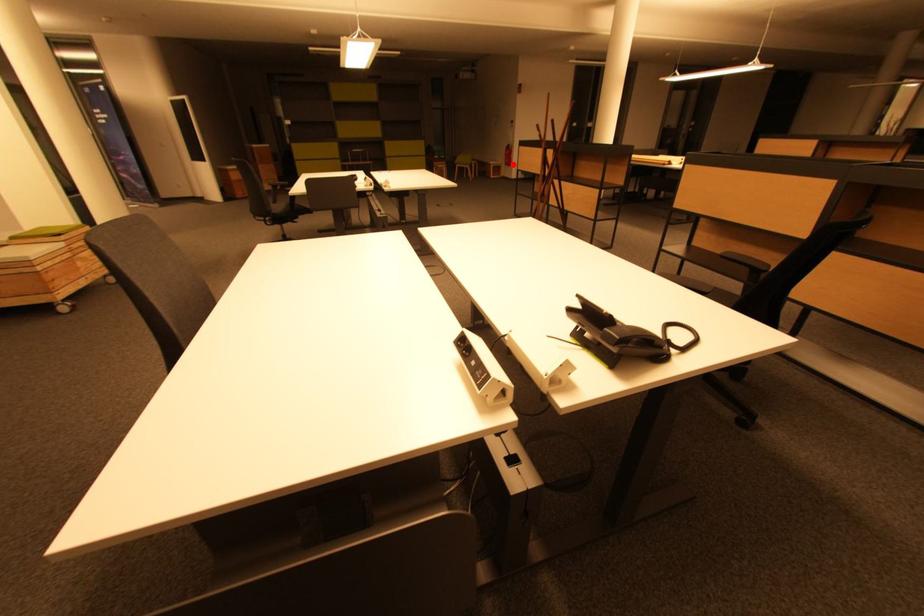
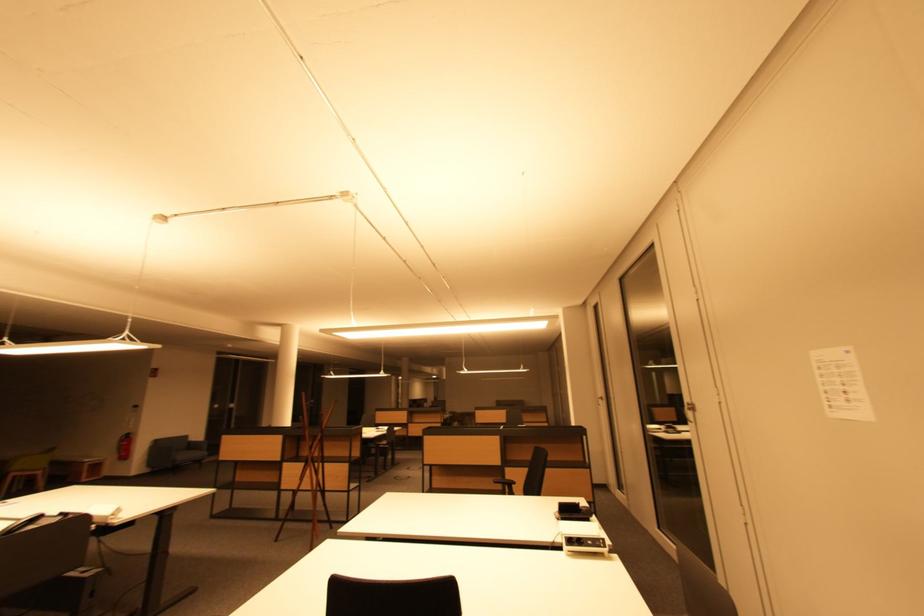
Question: I am providing you with two images of the same scene from different viewpoints. Image1 has a red point marked. In image2, the corresponding 3D location appears at what relative position? Reply with the corresponding letter.

Choices:
 (A) Closer
 (B) Farther

Answer: (B)